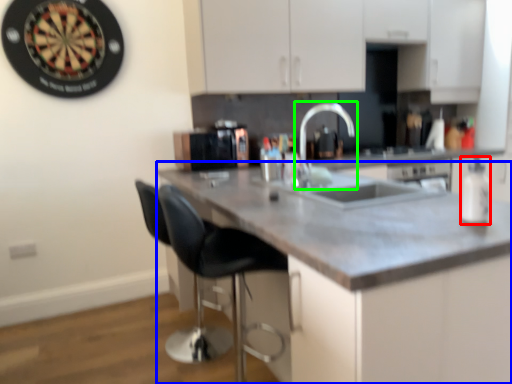
Question: Considering the real-world distances, which object is closest to bottle (highlighted by a red box)? countertop (highlighted by a blue box) or tap (highlighted by a green box).

Choices:
 (A) countertop
 (B) tap

Answer: (A)